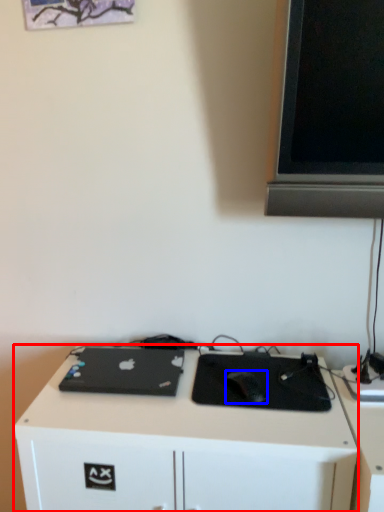
Question: Which of the following is the farthest to the observer, desk (highlighted by a red box) or mouse (highlighted by a blue box)?

Choices:
 (A) desk
 (B) mouse

Answer: (B)